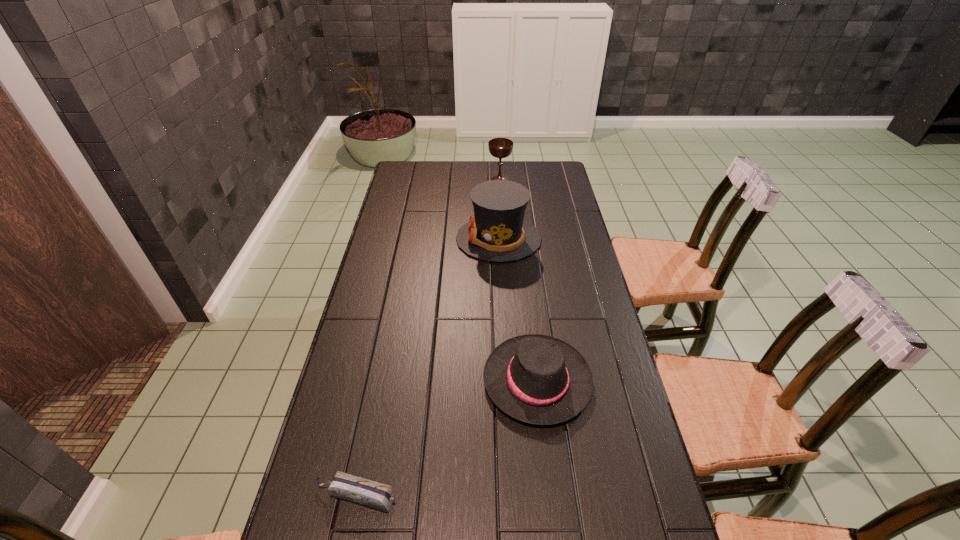
At what (x,y) coordinates should I click in order to perform the action: click on vacant point located between the nearer dress hat and the second farthest object. Please return your answer as a coordinate pair (x, y). Looking at the image, I should click on (517, 309).

Where is `vacant area that lies between the shorter dress hat and the chalice`? vacant area that lies between the shorter dress hat and the chalice is located at coordinates (518, 280).

This screenshot has height=540, width=960. I want to click on free space between the farther dress hat and the nearest object, so click(x=427, y=367).

This screenshot has height=540, width=960. Identify the location of vacant space in between the third farthest object and the pencil box. (446, 438).

Find the location of `unoccupied position between the leftmost object and the chalice`. unoccupied position between the leftmost object and the chalice is located at coordinates (428, 338).

Find the location of a particular element. The image size is (960, 540). vacant space that is in between the second farthest object and the shortest object is located at coordinates (427, 367).

At what (x,y) coordinates should I click in order to perform the action: click on free space that is in between the leftmost object and the third tallest object. Please return your answer as a coordinate pair (x, y). The height and width of the screenshot is (540, 960). Looking at the image, I should click on (446, 438).

At what (x,y) coordinates should I click in order to perform the action: click on free area in between the nearest object and the farther dress hat. Please return your answer as a coordinate pair (x, y). Image resolution: width=960 pixels, height=540 pixels. Looking at the image, I should click on (427, 367).

In order to click on blank region between the shorter dress hat and the third nearest object in this screenshot , I will do click(517, 309).

At what (x,y) coordinates should I click in order to perform the action: click on vacant area that lies between the chalice and the third tallest object. Please return your answer as a coordinate pair (x, y). The image size is (960, 540). Looking at the image, I should click on (518, 280).